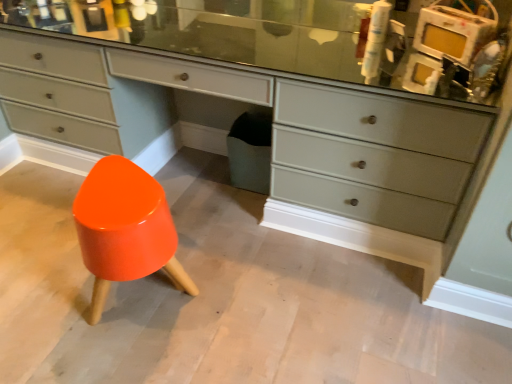
The height and width of the screenshot is (384, 512). Describe the element at coordinates (288, 107) in the screenshot. I see `matte gray chest of drawers at center` at that location.

Image resolution: width=512 pixels, height=384 pixels. In order to click on matte gray chest of drawers at center in this screenshot , I will do `click(288, 107)`.

From the picture: What is the approximate width of matte gray chest of drawers at center?

The width of matte gray chest of drawers at center is 48.47 centimeters.

At what (x,y) coordinates should I click in order to perform the action: click on matte gray chest of drawers at center. Please return your answer as a coordinate pair (x, y). Looking at the image, I should click on (288, 107).